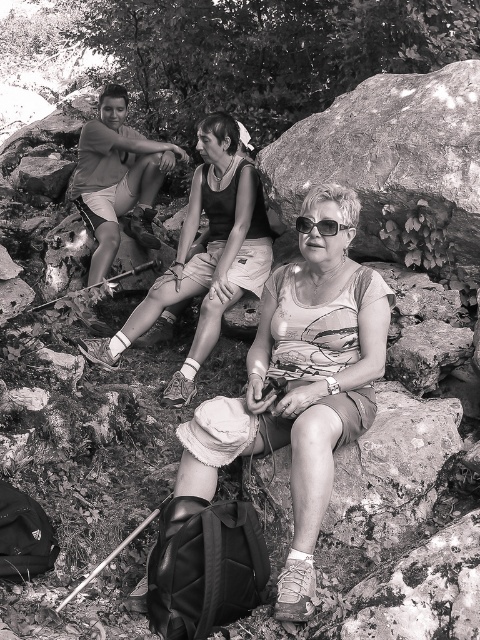
Question: Can you confirm if matte fabric hat at center is positioned below matte shorts at left?

Choices:
 (A) no
 (B) yes

Answer: (B)

Question: In this image, where is matte shorts at left located relative to black plastic sunglasses at center?

Choices:
 (A) right
 (B) left

Answer: (B)

Question: Is rough textured rock at center behind matte black tank top at center?

Choices:
 (A) yes
 (B) no

Answer: (B)

Question: Estimate the real-world distances between objects in this image. Which object is closer to the matte shorts at left?

Choices:
 (A) matte fabric hat at center
 (B) matte black tank top at center

Answer: (B)

Question: Which point is farther from the camera taking this photo?

Choices:
 (A) (148, 314)
 (B) (310, 230)
 (C) (478, 154)
 (D) (303, 509)

Answer: (A)

Question: Among these objects, which one is farthest from the camera?

Choices:
 (A) black plastic sunglasses at center
 (B) matte shorts at left
 (C) matte black tank top at center
 (D) matte fabric hat at center

Answer: (B)